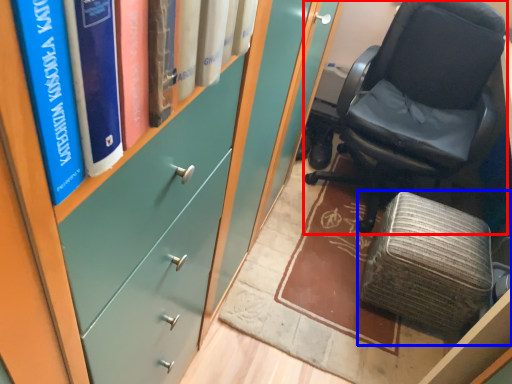
Question: Which of the following is the farthest to the observer, chair (highlighted by a red box) or furniture (highlighted by a blue box)?

Choices:
 (A) chair
 (B) furniture

Answer: (B)